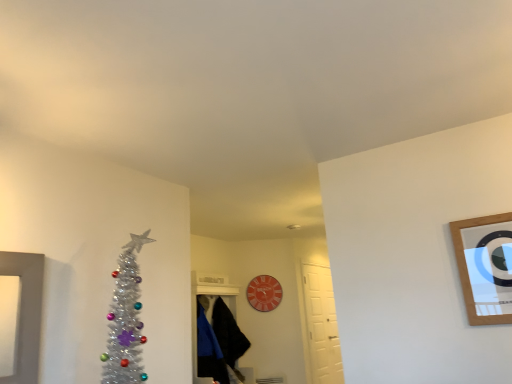
Question: Does black matte robe at center, which is counted as the first robe, starting from the front, have a greater height compared to white matte door at center-right?

Choices:
 (A) yes
 (B) no

Answer: (B)

Question: Considering the relative sizes of black matte robe at center, which ranks as the 2th robe in back-to-front order, and white matte door at center-right in the image provided, is black matte robe at center, which ranks as the 2th robe in back-to-front order, thinner than white matte door at center-right?

Choices:
 (A) yes
 (B) no

Answer: (B)

Question: Are black matte robe at center, which is counted as the first robe, starting from the front, and white matte door at center-right located far from each other?

Choices:
 (A) yes
 (B) no

Answer: (A)

Question: Is black matte robe at center, which ranks as the 2th robe in back-to-front order, closer to camera compared to white matte door at center-right?

Choices:
 (A) no
 (B) yes

Answer: (B)

Question: From a real-world perspective, is black matte robe at center, which ranks as the 2th robe in back-to-front order, beneath white matte door at center-right?

Choices:
 (A) no
 (B) yes

Answer: (A)

Question: In the image, is black matte robe at center, which is counted as the first robe, starting from the front, positioned in front of or behind wooden-framed mirror at upper right?

Choices:
 (A) behind
 (B) front

Answer: (A)

Question: From a real-world perspective, is black matte robe at center, which is counted as the first robe, starting from the front, positioned above or below wooden-framed mirror at upper right?

Choices:
 (A) below
 (B) above

Answer: (A)

Question: From the image's perspective, relative to wooden-framed mirror at upper right, is black matte robe at center, which is counted as the first robe, starting from the front, above or below?

Choices:
 (A) above
 (B) below

Answer: (B)

Question: Is black matte robe at center, which ranks as the 2th robe in back-to-front order, taller or shorter than wooden-framed mirror at upper right?

Choices:
 (A) tall
 (B) short

Answer: (A)

Question: From the image's perspective, relative to black matte robe at center, which is counted as the first robe, starting from the front, is white matte door at center-right above or below?

Choices:
 (A) above
 (B) below

Answer: (B)

Question: From a real-world perspective, is white matte door at center-right physically located above or below black matte robe at center, which ranks as the 2th robe in back-to-front order?

Choices:
 (A) below
 (B) above

Answer: (A)

Question: Is point (311, 379) closer or farther from the camera than point (210, 345)?

Choices:
 (A) farther
 (B) closer

Answer: (A)

Question: Which is correct: white matte door at center-right is inside black matte robe at center, which is counted as the first robe, starting from the front, or outside of it?

Choices:
 (A) inside
 (B) outside

Answer: (B)

Question: In terms of size, does wooden-framed mirror at upper right appear bigger or smaller than black fuzzy robe at center, the second robe in the front-to-back sequence?

Choices:
 (A) small
 (B) big

Answer: (A)

Question: Is wooden-framed mirror at upper right taller or shorter than black fuzzy robe at center, the second robe in the front-to-back sequence?

Choices:
 (A) short
 (B) tall

Answer: (A)